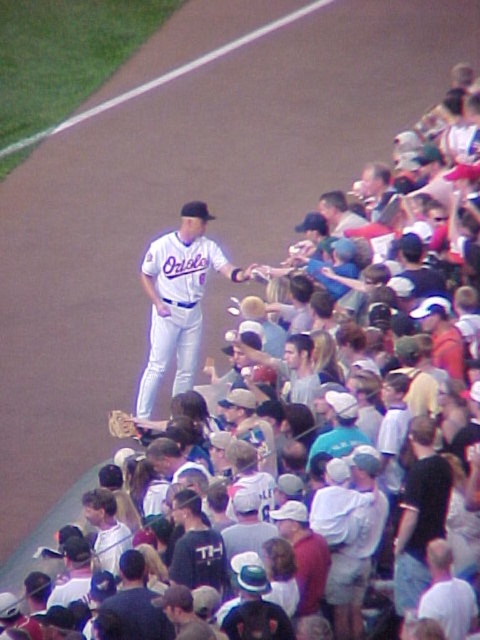
You are a photographer at the baseball game and want to take a photo of both the white cotton shirt at center and the white jersey at center. The minimum distance between them is required to be 10 feet for the camera to focus properly. Will you be able to capture both in focus?

The white cotton shirt at center and white jersey at center are 9.69 feet apart, which is less than the required 10 feet. Therefore, the camera may struggle to keep both in focus, so adjusting their positions or using a different camera setting might be necessary.

You are a photographer standing behind the baseball player wearing a white matte baseball uniform at center and the brown leather glove at center. You want to take a picture that includes both objects in the frame. What is the minimum distance you need to move backward to ensure both objects are fully visible in the photo?

The white matte baseball uniform at center and brown leather glove at center are 1.19 meters apart. To capture both in the frame, you need to move back at least 1.19 meters so that the camera can encompass the entire distance between them.